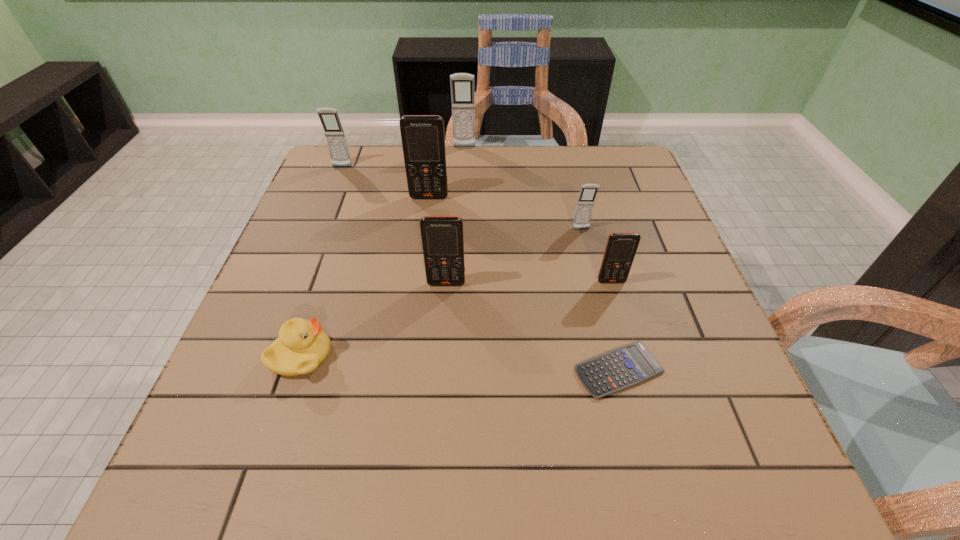
Where is `free region located on the back of the shortest object`? The height and width of the screenshot is (540, 960). free region located on the back of the shortest object is located at coordinates (590, 256).

At what (x,y) coordinates should I click in order to perform the action: click on cellular telephone situated at the left edge. Please return your answer as a coordinate pair (x, y). This screenshot has width=960, height=540. Looking at the image, I should click on (334, 133).

Image resolution: width=960 pixels, height=540 pixels. Identify the location of duckling situated at the left edge. (302, 346).

Where is `cellular telephone positioned at the right edge`? This screenshot has height=540, width=960. cellular telephone positioned at the right edge is located at coordinates (621, 247).

The width and height of the screenshot is (960, 540). What are the coordinates of `calculator present at the right edge` in the screenshot? It's located at (621, 368).

The height and width of the screenshot is (540, 960). I want to click on object located at the far left corner, so click(334, 133).

In order to click on vacant region at the far edge of the desktop in this screenshot , I will do `click(505, 178)`.

Where is `vacant region at the near edge of the desktop`? vacant region at the near edge of the desktop is located at coordinates (540, 488).

Identify the location of free space at the left edge of the desktop. (228, 399).

Find the location of `free space at the right edge of the desktop`. free space at the right edge of the desktop is located at coordinates (688, 336).